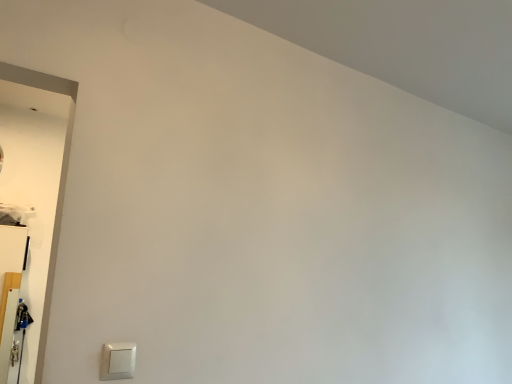
Measure the distance between point (108, 356) and camera.

3.52 feet.

At what (x,y) coordinates should I click in order to perform the action: click on white plastic light switch at lower left. Please return your answer as a coordinate pair (x, y). This screenshot has height=384, width=512. Looking at the image, I should click on (118, 361).

The width and height of the screenshot is (512, 384). Describe the element at coordinates (118, 361) in the screenshot. I see `white plastic light switch at lower left` at that location.

What is the approximate height of white plastic light switch at lower left?

The height of white plastic light switch at lower left is 3.59 inches.

This screenshot has height=384, width=512. What are the coordinates of `white plastic light switch at lower left` in the screenshot? It's located at (118, 361).